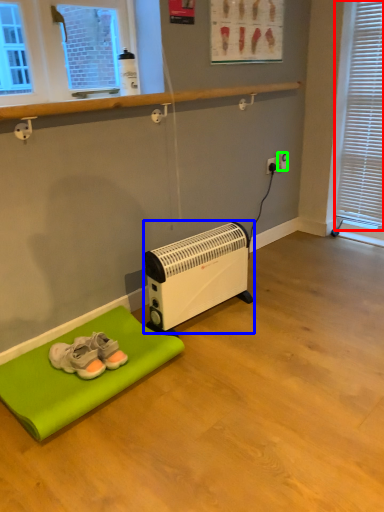
Question: Considering the real-world distances, which object is farthest from blind (highlighted by a red box)? heater (highlighted by a blue box) or electric outlet (highlighted by a green box)?

Choices:
 (A) heater
 (B) electric outlet

Answer: (A)